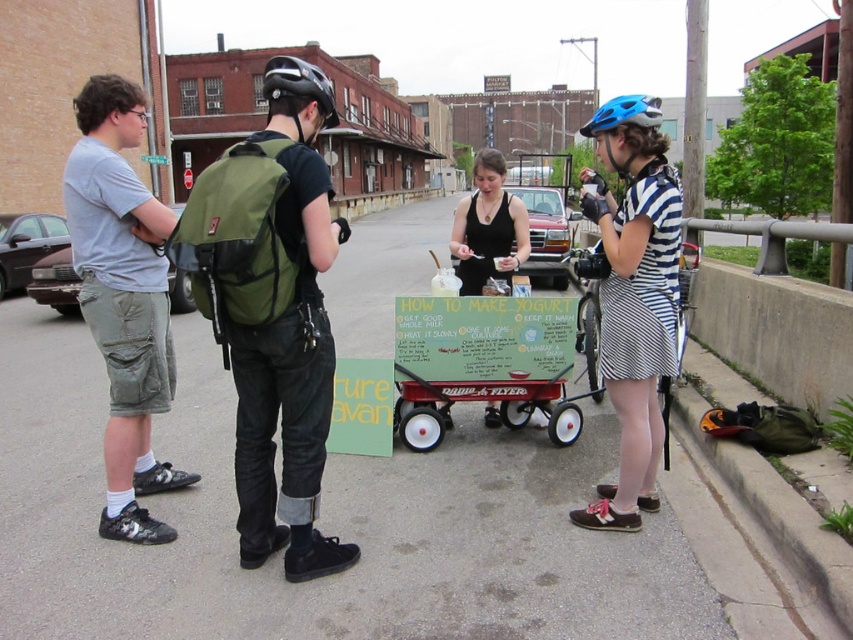
Question: Can you confirm if striped cotton dress at right is smaller than blue matte bicycle helmet at upper right?

Choices:
 (A) no
 (B) yes

Answer: (B)

Question: Is black matte helmet at upper center wider than blue matte bicycle helmet at upper center?

Choices:
 (A) yes
 (B) no

Answer: (B)

Question: In this image, where is striped cotton dress at right located relative to black fabric sign at center?

Choices:
 (A) below
 (B) above

Answer: (A)

Question: Which object is closer to the camera taking this photo?

Choices:
 (A) black fabric sign at center
 (B) blue matte bicycle helmet at upper right
 (C) striped cotton dress at right

Answer: (C)

Question: Based on their relative distances, which object is farther from the light gray cotton t-shirt at left?

Choices:
 (A) green fabric backpack at center
 (B) blue matte bicycle helmet at upper right
 (C) striped cotton dress at right

Answer: (B)

Question: Which point appears closest to the camera in this image?

Choices:
 (A) (329, 97)
 (B) (519, 260)
 (C) (317, 67)
 (D) (643, 99)

Answer: (A)